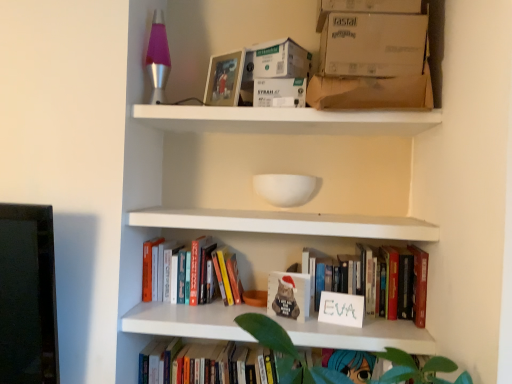
Question: From the image's perspective, relative to hardcover book at lower center, which is the 3th book in top-to-bottom order, is white cardboard box at upper right, the second cardboard box positioned from the bottom, above or below?

Choices:
 (A) below
 (B) above

Answer: (B)

Question: From a real-world perspective, is white cardboard box at upper right, the 2th cardboard box in the top-to-bottom sequence, above or below hardcover book at lower center, marked as the 1th book in a bottom-to-top arrangement?

Choices:
 (A) below
 (B) above

Answer: (B)

Question: Which object is the farthest from the white cardboard box at upper right, the 2th cardboard box in the top-to-bottom sequence?

Choices:
 (A) white cardboard box at upper center
 (B) matte plastic picture frame at upper center
 (C) white matte shelf at upper center
 (D) white cardboard box at upper center, the 3th cardboard box positioned from the bottom
 (E) brown cardboard box at upper center, which is the first cardboard box in bottom-to-top order

Answer: (B)

Question: Which object is positioned closest to the hardcover books at center, acting as the 3th book starting from the bottom?

Choices:
 (A) white cardboard box at upper right, the second cardboard box positioned from the bottom
 (B) white cardboard box at upper center
 (C) matte white book at center
 (D) white matte shelf at upper center
 (E) hardcover book at lower center, marked as the 1th book in a bottom-to-top arrangement

Answer: (E)